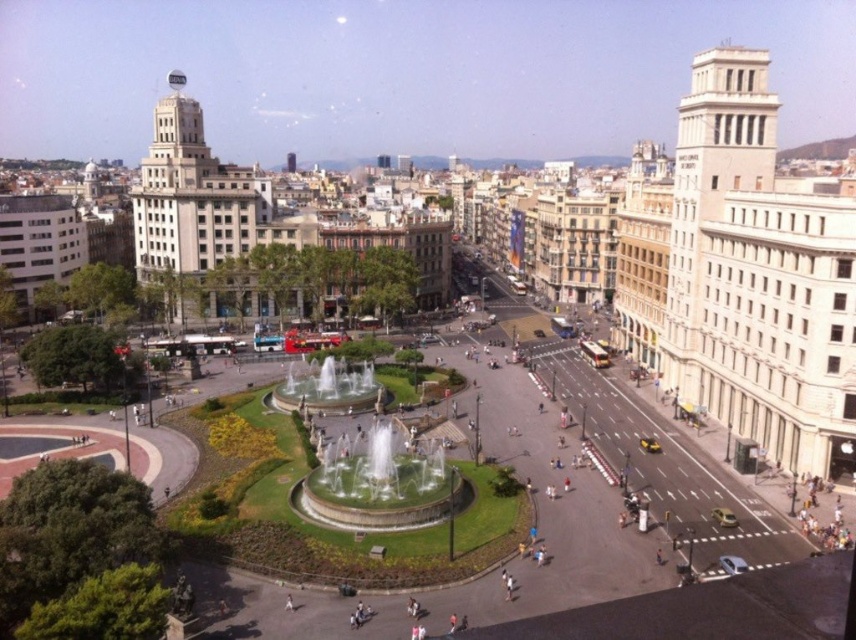
Does white marble fountain at center have a larger size compared to polished stone fountain at center?

Yes.

Locate an element on the screen. This screenshot has width=856, height=640. white marble fountain at center is located at coordinates (378, 481).

This screenshot has width=856, height=640. Find the location of `white marble fountain at center`. white marble fountain at center is located at coordinates (378, 481).